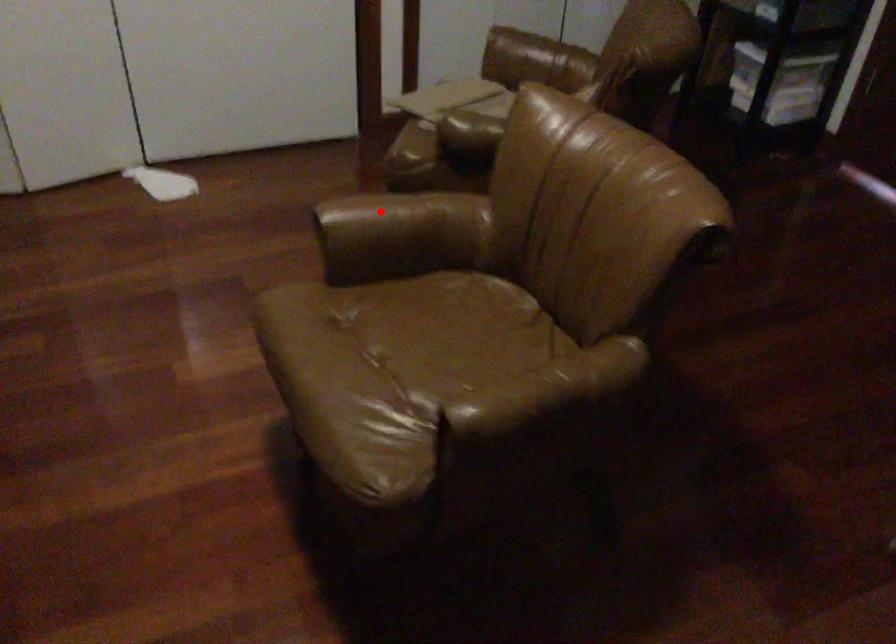
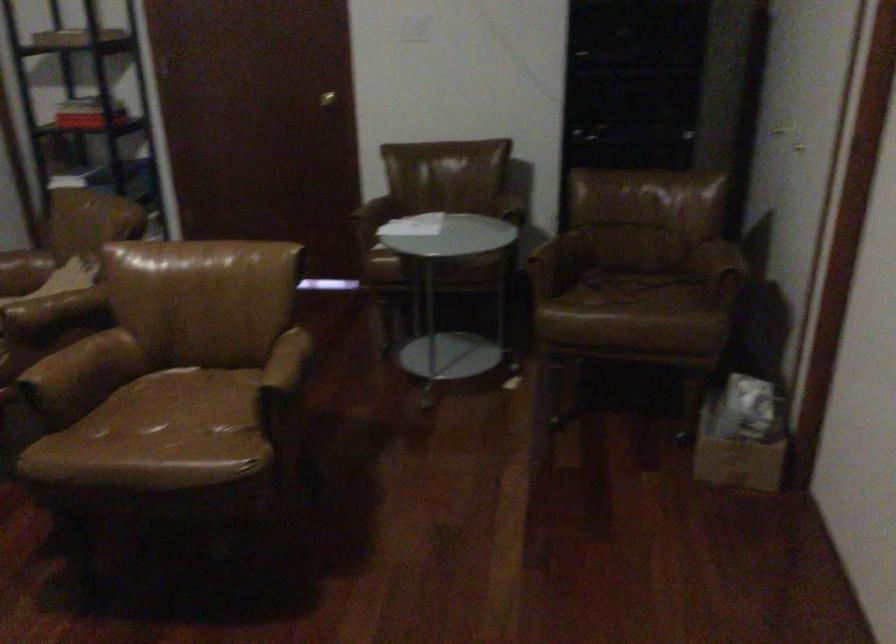
Locate, in the second image, the point that corresponds to the highlighted location in the first image.

(61, 361)